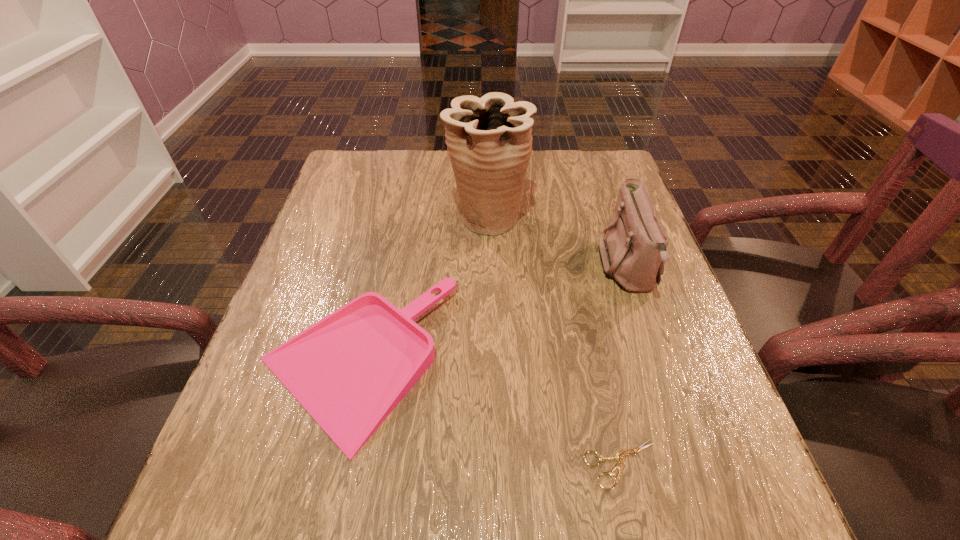
The image size is (960, 540). Find the location of `free space between the shortest object and the urn`. free space between the shortest object and the urn is located at coordinates (555, 341).

This screenshot has width=960, height=540. Find the location of `free point between the third tallest object and the shoulder bag`. free point between the third tallest object and the shoulder bag is located at coordinates (492, 314).

Find the location of `empty location between the dustpan and the urn`. empty location between the dustpan and the urn is located at coordinates (421, 289).

You are a GUI agent. You are given a task and a screenshot of the screen. Output one action in this format:
    pyautogui.click(x=<x>, y=<y>)
    Task: Click on the vacant area that lies between the shortest object and the dustpan
    
    Given the screenshot: What is the action you would take?
    pos(489,413)

Identify the location of vacant region between the shoulder bag and the third tallest object. This screenshot has width=960, height=540. click(492, 314).

At what (x,y) coordinates should I click in order to perform the action: click on vacant area that lies between the tallest object and the shortest object. Please return your answer as a coordinate pair (x, y). The width and height of the screenshot is (960, 540). Looking at the image, I should click on (555, 341).

Image resolution: width=960 pixels, height=540 pixels. Find the location of `free space between the shortest object and the tallest object`. free space between the shortest object and the tallest object is located at coordinates (555, 341).

This screenshot has height=540, width=960. Find the location of `empty space between the urn and the shears`. empty space between the urn and the shears is located at coordinates (555, 341).

Locate an element on the screen. empty space that is in between the urn and the shoulder bag is located at coordinates (558, 242).

Locate an element on the screen. free spot between the tallest object and the dustpan is located at coordinates (421, 289).